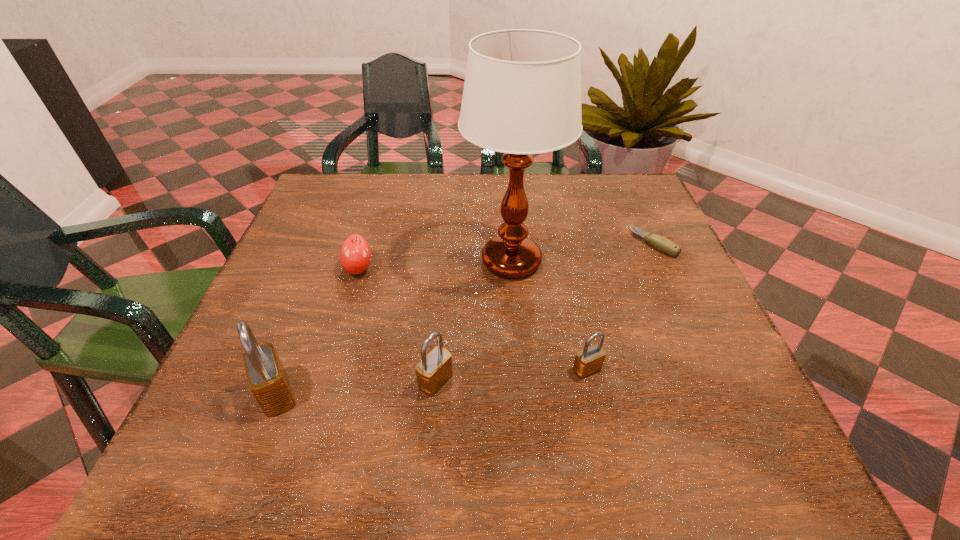
With all padlocks evenly spaced, where should an extra padlock be placed on the right to continue the pattern? Please point out a vacant space. Please provide its 2D coordinates. Your answer should be formatted as a tuple, i.e. [(x, y)], where the tuple contains the x and y coordinates of a point satisfying the conditions above.

[(732, 357)]